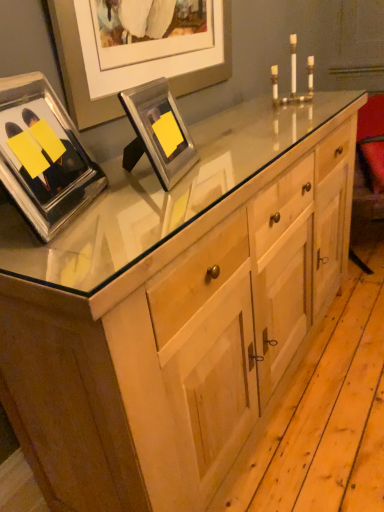
Question: Considering the relative sizes of metallic silver picture frame at upper center, arranged as the 1th picture frame when viewed from the right, and clear glass picture frame at upper left, which is the 1th picture frame from left to right, in the image provided, is metallic silver picture frame at upper center, arranged as the 1th picture frame when viewed from the right, wider than clear glass picture frame at upper left, which is the 1th picture frame from left to right,?

Choices:
 (A) yes
 (B) no

Answer: (B)

Question: Is metallic silver picture frame at upper center, arranged as the second picture frame when viewed from the left, with clear glass picture frame at upper left, which is the second picture frame in right-to-left order?

Choices:
 (A) no
 (B) yes

Answer: (A)

Question: From the image's perspective, is metallic silver picture frame at upper center, arranged as the second picture frame when viewed from the left, under clear glass picture frame at upper left, which is the 1th picture frame from left to right?

Choices:
 (A) yes
 (B) no

Answer: (B)

Question: Considering the relative sizes of metallic silver picture frame at upper center, arranged as the second picture frame when viewed from the left, and clear glass picture frame at upper left, which is the second picture frame in right-to-left order, in the image provided, is metallic silver picture frame at upper center, arranged as the second picture frame when viewed from the left, smaller than clear glass picture frame at upper left, which is the second picture frame in right-to-left order,?

Choices:
 (A) no
 (B) yes

Answer: (B)

Question: Can you confirm if metallic silver picture frame at upper center, arranged as the 1th picture frame when viewed from the right, is bigger than clear glass picture frame at upper left, which is the 1th picture frame from left to right?

Choices:
 (A) no
 (B) yes

Answer: (A)

Question: Looking at the image, does clear glass picture frame at upper left, which is the second picture frame in right-to-left order, seem bigger or smaller compared to metallic silver picture frame at upper center, arranged as the second picture frame when viewed from the left?

Choices:
 (A) big
 (B) small

Answer: (A)

Question: Visually, is clear glass picture frame at upper left, which is the second picture frame in right-to-left order, positioned to the left or to the right of metallic silver picture frame at upper center, arranged as the second picture frame when viewed from the left?

Choices:
 (A) left
 (B) right

Answer: (A)

Question: From a real-world perspective, relative to metallic silver picture frame at upper center, arranged as the second picture frame when viewed from the left, is clear glass picture frame at upper left, which is the 1th picture frame from left to right, vertically above or below?

Choices:
 (A) below
 (B) above

Answer: (B)

Question: Considering the positions of clear glass picture frame at upper left, which is the second picture frame in right-to-left order, and metallic silver picture frame at upper center, arranged as the second picture frame when viewed from the left, in the image, is clear glass picture frame at upper left, which is the second picture frame in right-to-left order, taller or shorter than metallic silver picture frame at upper center, arranged as the second picture frame when viewed from the left,?

Choices:
 (A) tall
 (B) short

Answer: (A)

Question: Is clear glass picture frame at upper left, which is the second picture frame in right-to-left order, spatially inside gold metallic candle holder at upper center, or outside of it?

Choices:
 (A) inside
 (B) outside

Answer: (B)

Question: Relative to gold metallic candle holder at upper center, is clear glass picture frame at upper left, which is the 1th picture frame from left to right, in front or behind?

Choices:
 (A) front
 (B) behind

Answer: (A)

Question: From the image's perspective, is clear glass picture frame at upper left, which is the second picture frame in right-to-left order, positioned above or below gold metallic candle holder at upper center?

Choices:
 (A) above
 (B) below

Answer: (B)

Question: Looking at their shapes, would you say clear glass picture frame at upper left, which is the 1th picture frame from left to right, is wider or thinner than gold metallic candle holder at upper center?

Choices:
 (A) thin
 (B) wide

Answer: (A)

Question: From a real-world perspective, is gold metallic candle holder at upper center above or below clear glass picture frame at upper left, which is the 1th picture frame from left to right?

Choices:
 (A) above
 (B) below

Answer: (B)

Question: Which is correct: gold metallic candle holder at upper center is inside clear glass picture frame at upper left, which is the second picture frame in right-to-left order, or outside of it?

Choices:
 (A) inside
 (B) outside

Answer: (B)